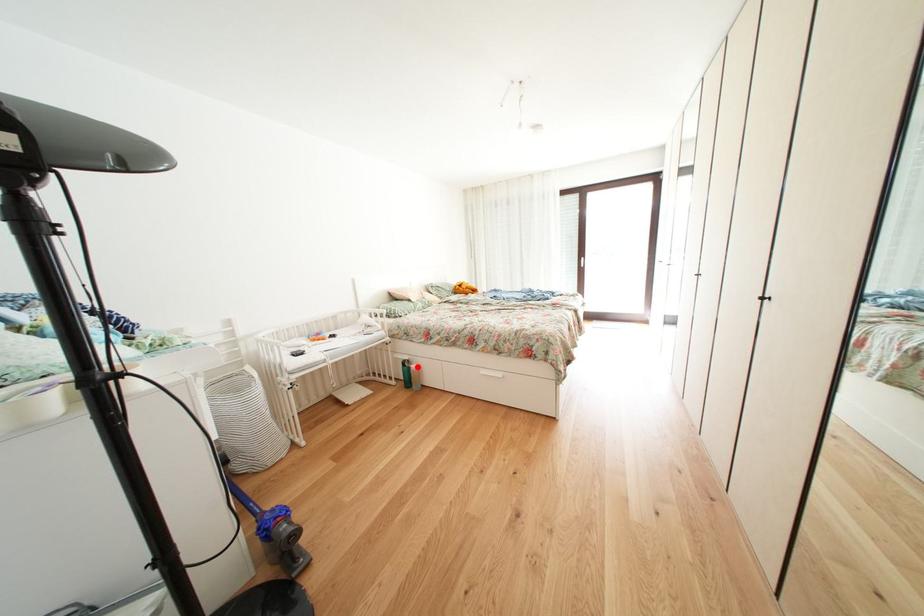
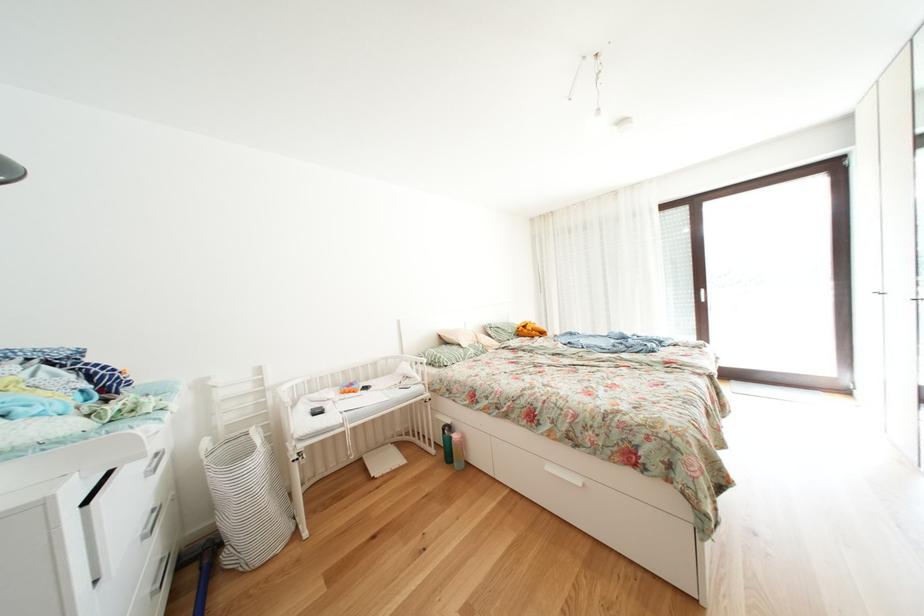
In the second image, find the point that corresponds to the highlighted location in the first image.

(458, 432)